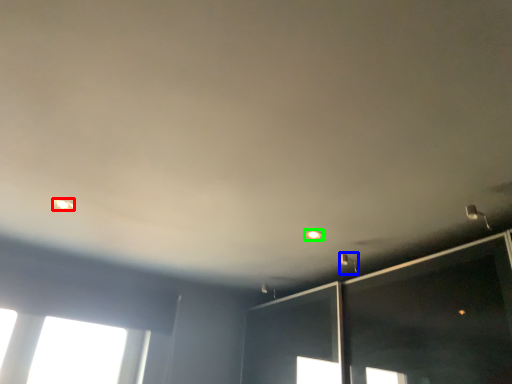
Question: Based on their relative distances, which object is nearer to dot (highlighted by a red box)? Choose from light fixture (highlighted by a blue box) and dot (highlighted by a green box).

Choices:
 (A) light fixture
 (B) dot

Answer: (B)